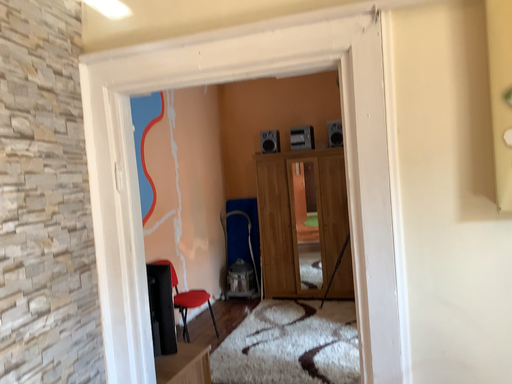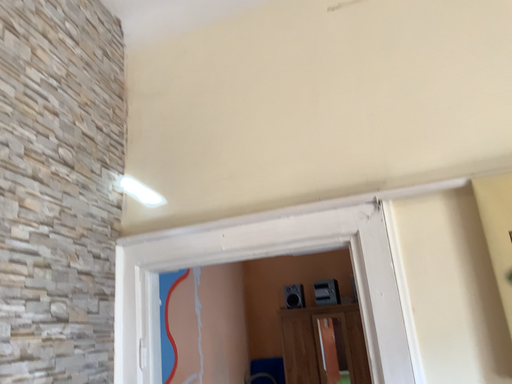
Question: Which way did the camera rotate in the video?

Choices:
 (A) rotated upward
 (B) rotated downward

Answer: (A)